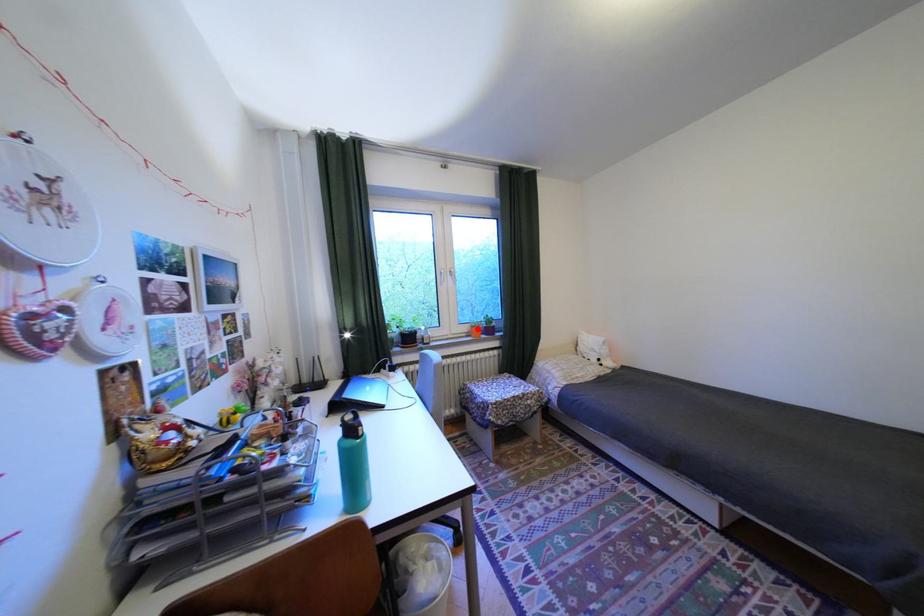
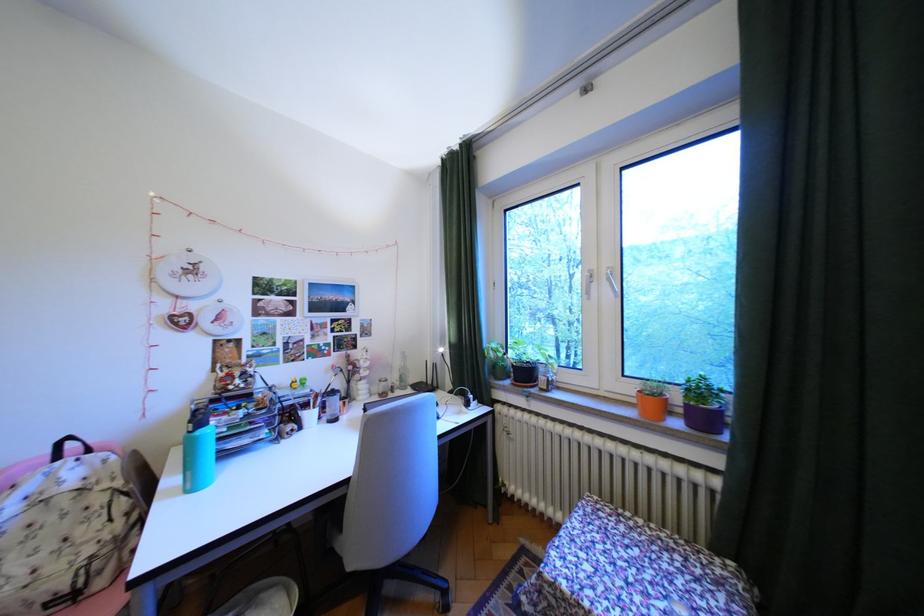
Locate, in the second image, the point that corresponds to the highlighted location in the first image.

(641, 390)